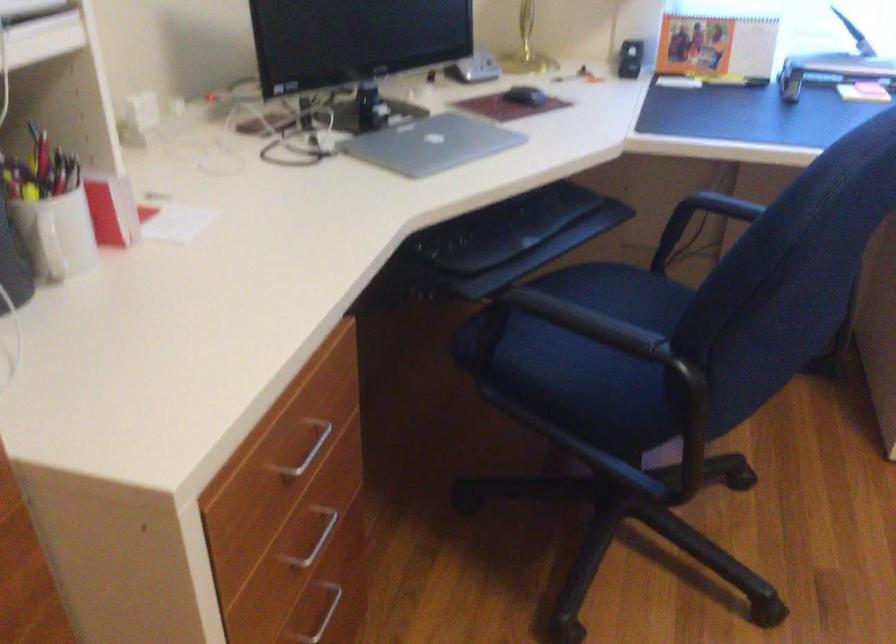
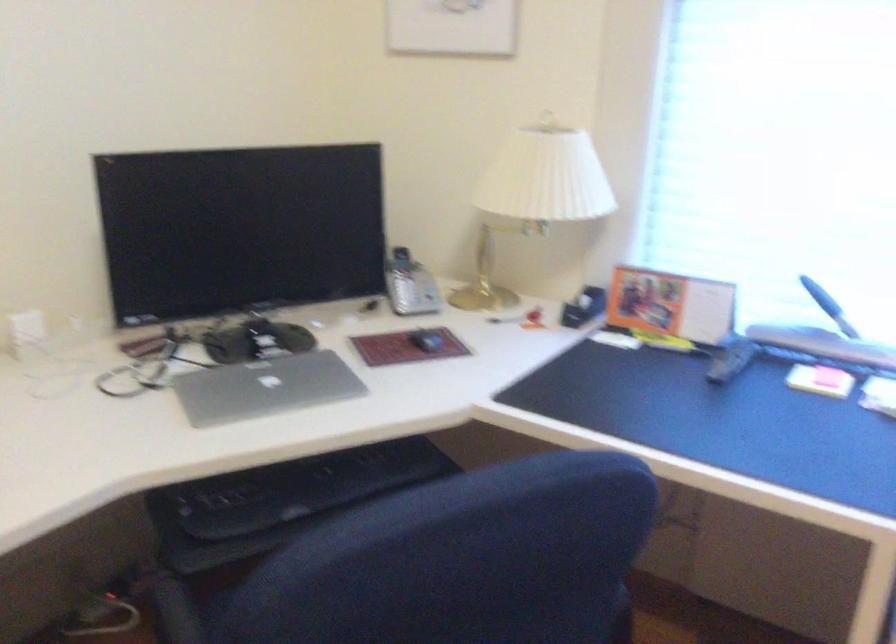
Question: The images are taken continuously from a first-person perspective. In which direction is your viewpoint rotating?

Choices:
 (A) Left
 (B) Right
 (C) Up
 (D) Down

Answer: (A)